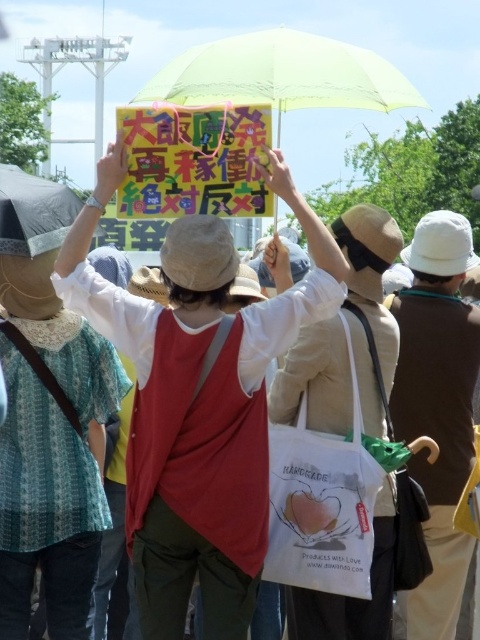
Question: Which of the following is the farthest from the observer?

Choices:
 (A) (199, 141)
 (B) (331, 108)
 (C) (458, 570)
 (D) (183, 550)

Answer: (B)

Question: Is transparent yellow umbrella at upper center above matte black umbrella at upper left?

Choices:
 (A) yes
 (B) no

Answer: (A)

Question: Is white fabric bag at center smaller than white fabric tote at center?

Choices:
 (A) yes
 (B) no

Answer: (B)

Question: Which object is positioned farthest from the matte white shirt at center?

Choices:
 (A) white fabric tote at center
 (B) yellow paper sign at upper center
 (C) white fabric bag at center
 (D) matte black umbrella at upper left

Answer: (C)

Question: Which object appears farthest from the camera in this image?

Choices:
 (A) yellow paper sign at upper center
 (B) transparent yellow umbrella at upper center

Answer: (B)

Question: Does white fabric bag at center appear on the left side of white fabric tote at center?

Choices:
 (A) yes
 (B) no

Answer: (B)